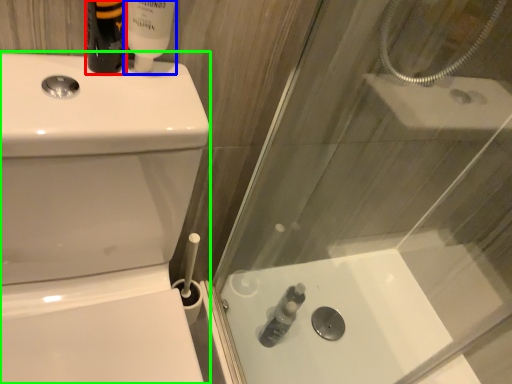
Question: Considering the real-world distances, which object is farthest from toiletry (highlighted by a red box)? toiletry (highlighted by a blue box) or toilet bowl (highlighted by a green box)?

Choices:
 (A) toiletry
 (B) toilet bowl

Answer: (B)